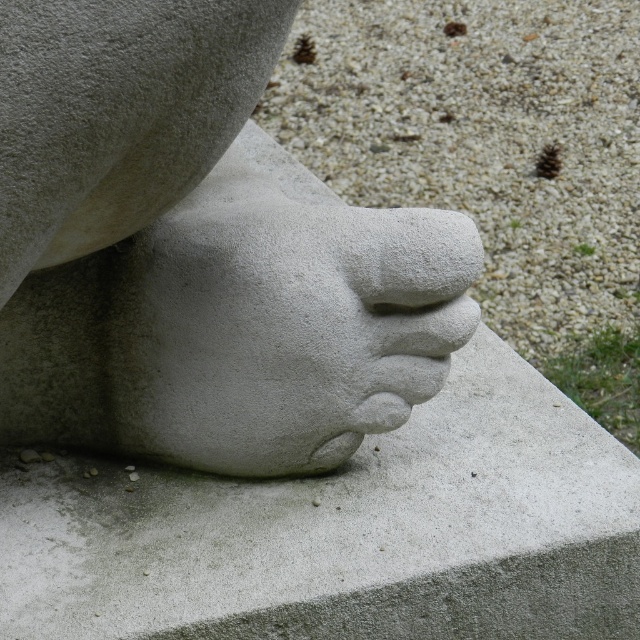
Question: Is white stone foot at center bigger than white stone hand at center?

Choices:
 (A) yes
 (B) no

Answer: (A)

Question: Can you confirm if white stone foot at center is thinner than gray stone sculpture at center?

Choices:
 (A) yes
 (B) no

Answer: (A)

Question: Which object is positioned farthest from the white stone foot at center?

Choices:
 (A) gray stone sculpture at center
 (B) white stone hand at center

Answer: (A)

Question: Which point appears closest to the camera in this image?

Choices:
 (A) (163, 445)
 (B) (205, 419)

Answer: (B)

Question: Which point appears farthest from the camera in this image?

Choices:
 (A) (189, 336)
 (B) (186, 236)

Answer: (B)

Question: Is gray stone sculpture at center bigger than white stone hand at center?

Choices:
 (A) yes
 (B) no

Answer: (A)